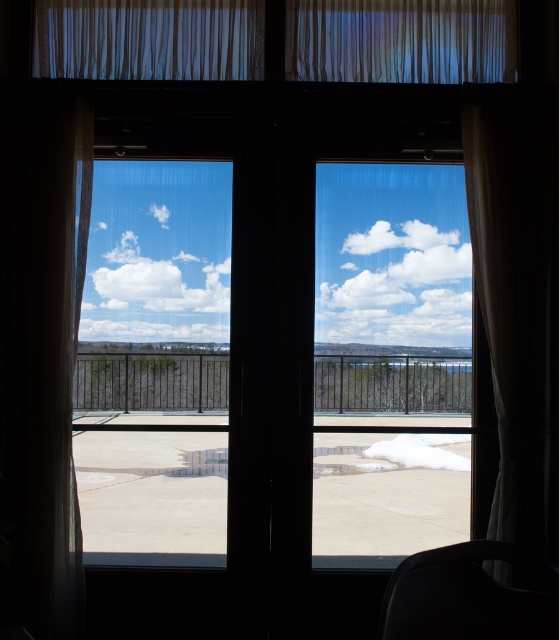
Question: Which point appears farthest from the camera in this image?

Choices:
 (A) (509, 536)
 (B) (315, 48)
 (C) (490, 636)

Answer: (B)

Question: Which of the following is the farthest from the observer?

Choices:
 (A) sheer white curtain at left
 (B) satin white curtains at upper center

Answer: (B)

Question: Which point is closer to the camera?

Choices:
 (A) (416, 561)
 (B) (513, 200)

Answer: (A)

Question: Can you confirm if sheer white curtain at left is positioned below smooth concrete tarmac at center?

Choices:
 (A) yes
 (B) no

Answer: (B)

Question: Is sheer white curtain at left wider than white sheer curtain at right?

Choices:
 (A) no
 (B) yes

Answer: (A)

Question: Can you confirm if smooth concrete tarmac at center is positioned above satin white curtains at upper center?

Choices:
 (A) yes
 (B) no

Answer: (B)